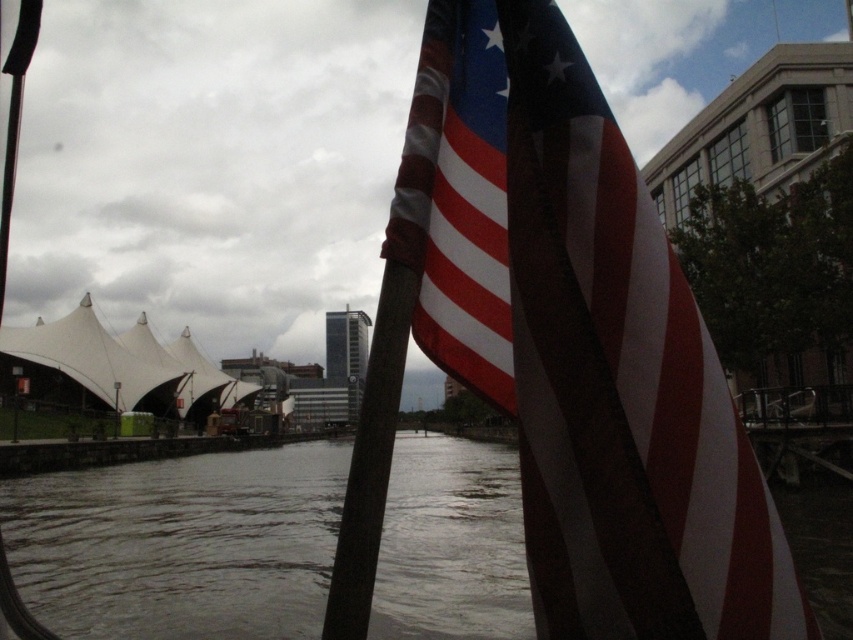
Question: Is american flag at upper right to the right of dark brown wooden pole at center from the viewer's perspective?

Choices:
 (A) no
 (B) yes

Answer: (B)

Question: Among these objects, which one is farthest from the camera?

Choices:
 (A) dark brown wooden pole at center
 (B) dark gray water at center

Answer: (B)

Question: Does american flag at upper right appear under dark brown wooden pole at center?

Choices:
 (A) no
 (B) yes

Answer: (A)

Question: Which point is closer to the camera taking this photo?

Choices:
 (A) (10, 481)
 (B) (364, 429)
 (C) (735, 634)

Answer: (C)

Question: Does american flag at upper right come behind dark gray water at center?

Choices:
 (A) yes
 (B) no

Answer: (B)

Question: Which point is closer to the camera?

Choices:
 (A) (405, 284)
 (B) (433, 627)
 (C) (466, 298)

Answer: (A)